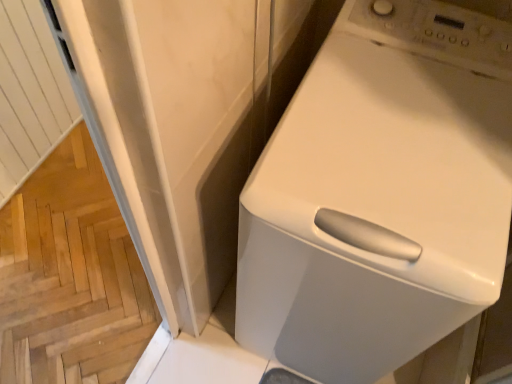
The height and width of the screenshot is (384, 512). Describe the element at coordinates (70, 276) in the screenshot. I see `wooden parquet floor at lower left` at that location.

Identify the location of wooden parquet floor at lower left. (70, 276).

What is the approximate width of white glossy washing machine at upper right?

23.94 inches.

Identify the location of white glossy washing machine at upper right. (380, 194).

The image size is (512, 384). What do you see at coordinates (380, 194) in the screenshot?
I see `white glossy washing machine at upper right` at bounding box center [380, 194].

This screenshot has width=512, height=384. I want to click on wooden parquet floor at lower left, so click(x=70, y=276).

Considering the relative positions of white glossy washing machine at upper right and wooden parquet floor at lower left in the image provided, is white glossy washing machine at upper right to the left of wooden parquet floor at lower left from the viewer's perspective?

No.

In the scene shown: Considering their positions, is white glossy washing machine at upper right located in front of or behind wooden parquet floor at lower left?

In the image, white glossy washing machine at upper right appears in front of wooden parquet floor at lower left.

Between point (501, 193) and point (54, 212), which one is positioned behind?

The point (54, 212) is farther from the camera.

From the image's perspective, is white glossy washing machine at upper right above or below wooden parquet floor at lower left?

Based on their image positions, white glossy washing machine at upper right is located above wooden parquet floor at lower left.

From a real-world perspective, is white glossy washing machine at upper right located beneath wooden parquet floor at lower left?

No.

Between white glossy washing machine at upper right and wooden parquet floor at lower left, which one has smaller width?

white glossy washing machine at upper right is thinner.

Can you confirm if white glossy washing machine at upper right is taller than wooden parquet floor at lower left?

Yes.

Between white glossy washing machine at upper right and wooden parquet floor at lower left, which one has smaller size?

wooden parquet floor at lower left is smaller.

Can we say white glossy washing machine at upper right lies outside wooden parquet floor at lower left?

white glossy washing machine at upper right lies outside wooden parquet floor at lower left's area.

Is white glossy washing machine at upper right beside wooden parquet floor at lower left?

No, white glossy washing machine at upper right is not with wooden parquet floor at lower left.

Is white glossy washing machine at upper right aimed at wooden parquet floor at lower left?

No, white glossy washing machine at upper right is not facing towards wooden parquet floor at lower left.

Where is `home appliance above the wooden parquet floor at lower left (from a real-world perspective)`? The height and width of the screenshot is (384, 512). home appliance above the wooden parquet floor at lower left (from a real-world perspective) is located at coordinates (380, 194).

Can you confirm if wooden parquet floor at lower left is positioned to the left of white glossy washing machine at upper right?

Yes.

Which object is more forward, wooden parquet floor at lower left or white glossy washing machine at upper right?

white glossy washing machine at upper right is closer to the camera.

Considering the points (104, 348) and (375, 109), which point is behind, point (104, 348) or point (375, 109)?

Positioned behind is point (104, 348).

From the image's perspective, which is above, wooden parquet floor at lower left or white glossy washing machine at upper right?

white glossy washing machine at upper right, from the image's perspective.

From a real-world perspective, is wooden parquet floor at lower left located higher than white glossy washing machine at upper right?

No, from a real-world perspective, wooden parquet floor at lower left is not over white glossy washing machine at upper right

Between wooden parquet floor at lower left and white glossy washing machine at upper right, which one has smaller width?

With smaller width is white glossy washing machine at upper right.

Considering the relative sizes of wooden parquet floor at lower left and white glossy washing machine at upper right in the image provided, is wooden parquet floor at lower left shorter than white glossy washing machine at upper right?

Correct, wooden parquet floor at lower left is not as tall as white glossy washing machine at upper right.

Is wooden parquet floor at lower left bigger or smaller than white glossy washing machine at upper right?

Clearly, wooden parquet floor at lower left is smaller in size than white glossy washing machine at upper right.

Is wooden parquet floor at lower left inside the boundaries of white glossy washing machine at upper right, or outside?

wooden parquet floor at lower left lies outside white glossy washing machine at upper right.

Is wooden parquet floor at lower left far away from white glossy washing machine at upper right?

That's not correct — wooden parquet floor at lower left is a little close to white glossy washing machine at upper right.

Is wooden parquet floor at lower left oriented towards white glossy washing machine at upper right?

No, wooden parquet floor at lower left does not turn towards white glossy washing machine at upper right.

In the scene shown: How much distance is there between wooden parquet floor at lower left and white glossy washing machine at upper right?

They are 34.98 inches apart.

Find the location of `home appliance above the wooden parquet floor at lower left (from a real-world perspective)`. home appliance above the wooden parquet floor at lower left (from a real-world perspective) is located at coordinates (380, 194).

There is a wooden parquet floor at lower left. Identify the location of home appliance above it (from a real-world perspective). point(380,194).

The image size is (512, 384). In order to click on home appliance lying on the right of wooden parquet floor at lower left in this screenshot , I will do `click(380, 194)`.